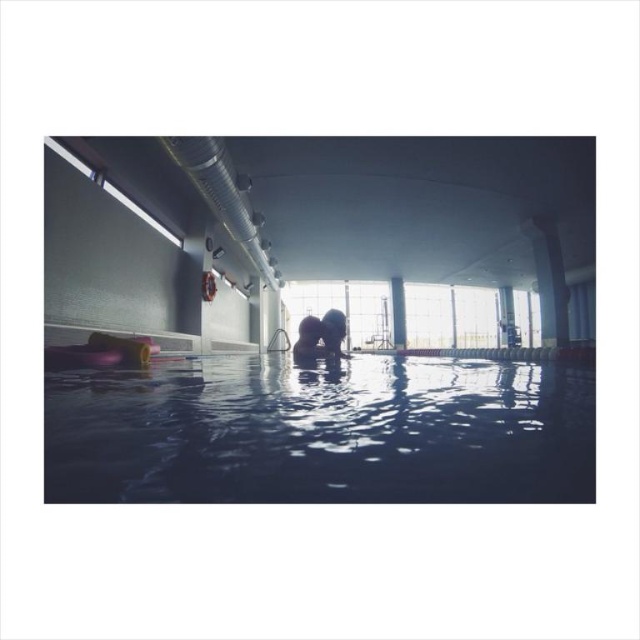
You are standing at the edge of the pool and see the point marked at coordinates (x=323, y=433). What is located at that point?

The point at (x=323, y=433) marks transparent blue water at center.

You are a lifeguard standing at the edge of the pool. You notice a swimmer in the center of the pool. Where exactly is the transparent blue water at center located in terms of coordinates?

The transparent blue water at center is located at point coordinates of (x=323, y=433).